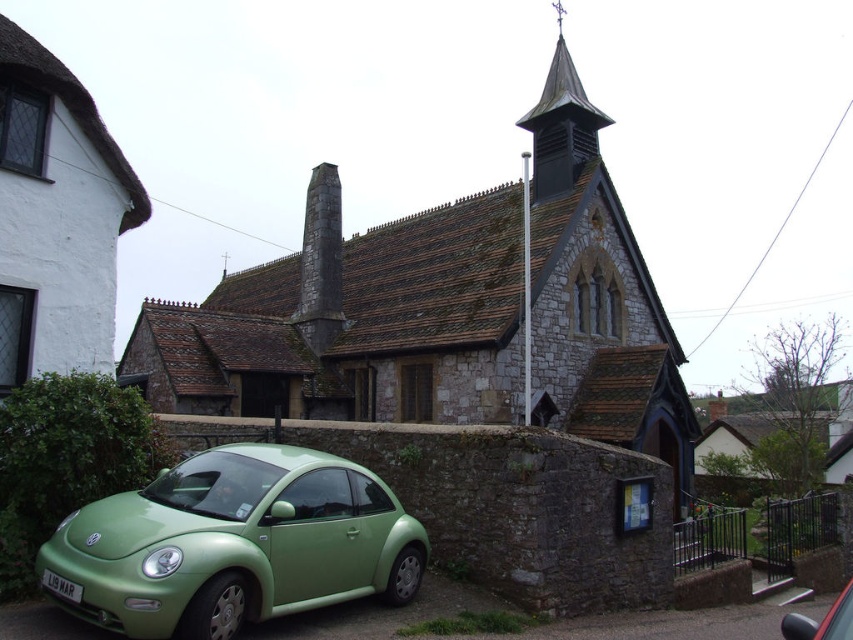
Is stone church at center further to camera compared to green matte car at lower left?

Yes, stone church at center is behind green matte car at lower left.

Between stone church at center and green matte car at lower left, which one has less height?

With less height is green matte car at lower left.

Is point (479, 321) closer to camera compared to point (805, 621)?

No, it is behind (805, 621).

You are a GUI agent. You are given a task and a screenshot of the screen. Output one action in this format:
    pyautogui.click(x=<x>, y=<y>)
    Task: Click on the stone church at center
    The image size is (853, 640).
    Given the screenshot: What is the action you would take?
    pyautogui.click(x=463, y=362)

Is stone church at center wider than matte green car at lower left?

Yes.

Which is behind, point (596, 396) or point (100, 624)?

Positioned behind is point (596, 396).

Where is `stone church at center`? Image resolution: width=853 pixels, height=640 pixels. stone church at center is located at coordinates (463, 362).

Who is more forward, (291, 500) or (798, 620)?

Positioned in front is point (291, 500).

Is matte green car at lower left in front of green matte car at lower left?

No, it is behind green matte car at lower left.

I want to click on matte green car at lower left, so (233, 545).